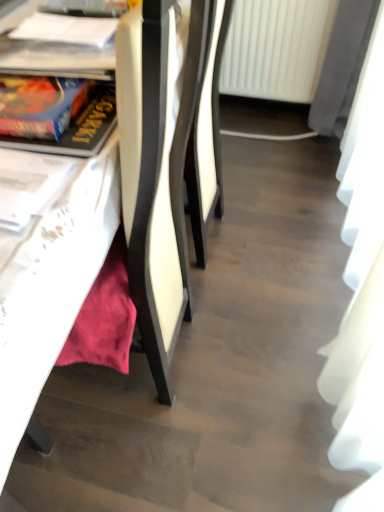
Question: Does white fabric curtain at right appear on the left side of blue cardboard book at left, positioned as the second book in top-to-bottom order?

Choices:
 (A) yes
 (B) no

Answer: (B)

Question: From the image's perspective, is white fabric curtain at right below blue cardboard book at left, which is counted as the 1th book, starting from the bottom?

Choices:
 (A) no
 (B) yes

Answer: (A)

Question: Is white fabric curtain at right positioned behind blue cardboard book at left, positioned as the second book in top-to-bottom order?

Choices:
 (A) yes
 (B) no

Answer: (B)

Question: Would you say white fabric curtain at right is a long distance from blue cardboard book at left, arranged as the first book when viewed from the front?

Choices:
 (A) yes
 (B) no

Answer: (A)

Question: Does white fabric curtain at right turn towards blue cardboard book at left, arranged as the first book when viewed from the front?

Choices:
 (A) no
 (B) yes

Answer: (B)

Question: From the image's perspective, is blue cardboard book at left, the second book positioned from the back, positioned above or below matte white table at lower left?

Choices:
 (A) below
 (B) above

Answer: (B)

Question: In the image, is blue cardboard book at left, positioned as the second book in top-to-bottom order, positioned in front of or behind matte white table at lower left?

Choices:
 (A) front
 (B) behind

Answer: (B)

Question: Considering the relative positions of blue cardboard book at left, arranged as the first book when viewed from the front, and matte white table at lower left in the image provided, is blue cardboard book at left, arranged as the first book when viewed from the front, to the left or to the right of matte white table at lower left?

Choices:
 (A) left
 (B) right

Answer: (B)

Question: Considering the positions of blue cardboard book at left, which is counted as the 1th book, starting from the bottom, and matte white table at lower left in the image, is blue cardboard book at left, which is counted as the 1th book, starting from the bottom, bigger or smaller than matte white table at lower left?

Choices:
 (A) small
 (B) big

Answer: (A)

Question: Is white fabric curtain at right wider or thinner than blue cardboard book at left, positioned as the second book in top-to-bottom order?

Choices:
 (A) thin
 (B) wide

Answer: (A)

Question: From a real-world perspective, is white fabric curtain at right positioned above or below blue cardboard book at left, arranged as the first book when viewed from the front?

Choices:
 (A) above
 (B) below

Answer: (B)

Question: Which is correct: white fabric curtain at right is inside blue cardboard book at left, the second book positioned from the back, or outside of it?

Choices:
 (A) inside
 (B) outside

Answer: (B)

Question: Is white fabric curtain at right taller or shorter than blue cardboard book at left, the second book positioned from the back?

Choices:
 (A) short
 (B) tall

Answer: (B)

Question: From a real-world perspective, is white paper at upper left, which ranks as the 1th book in top-to-bottom order, physically located above or below white fabric curtain at right?

Choices:
 (A) above
 (B) below

Answer: (A)

Question: In terms of height, does white paper at upper left, the first book from the back, look taller or shorter compared to white fabric curtain at right?

Choices:
 (A) short
 (B) tall

Answer: (A)